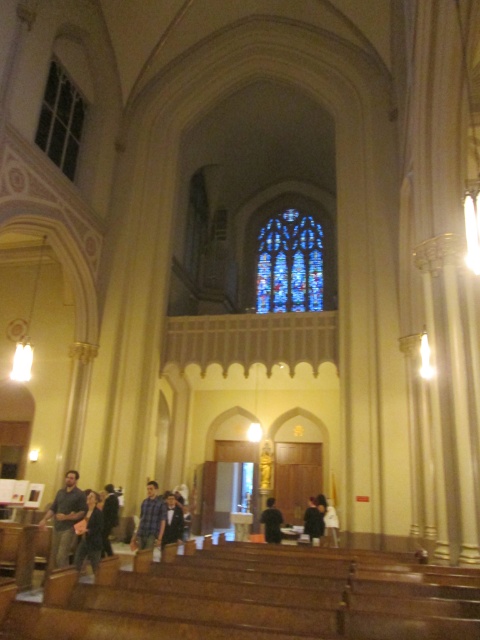
Based on the photo, how much distance is there between blue plaid shirt at center and black fabric at center?

The distance of blue plaid shirt at center from black fabric at center is 10.92 meters.

Is point (156, 536) positioned in front of point (271, 497)?

Yes, it is in front of point (271, 497).

The image size is (480, 640). I want to click on blue plaid shirt at center, so click(149, 518).

Is dark blue shirt at lower center shorter than dark blue shirt at center?

No.

Which is behind, point (103, 516) or point (167, 532)?

Positioned behind is point (167, 532).

Between point (105, 525) and point (180, 525), which one is positioned in front?

Point (105, 525)

This screenshot has height=640, width=480. I want to click on dark blue shirt at lower center, so click(108, 516).

Based on the photo, which is more to the left, black fabric at center or white cotton shirt at center?

black fabric at center is more to the left.

Does point (276, 541) come in front of point (316, 500)?

Yes.

Where is `black fabric at center`? black fabric at center is located at coordinates (272, 522).